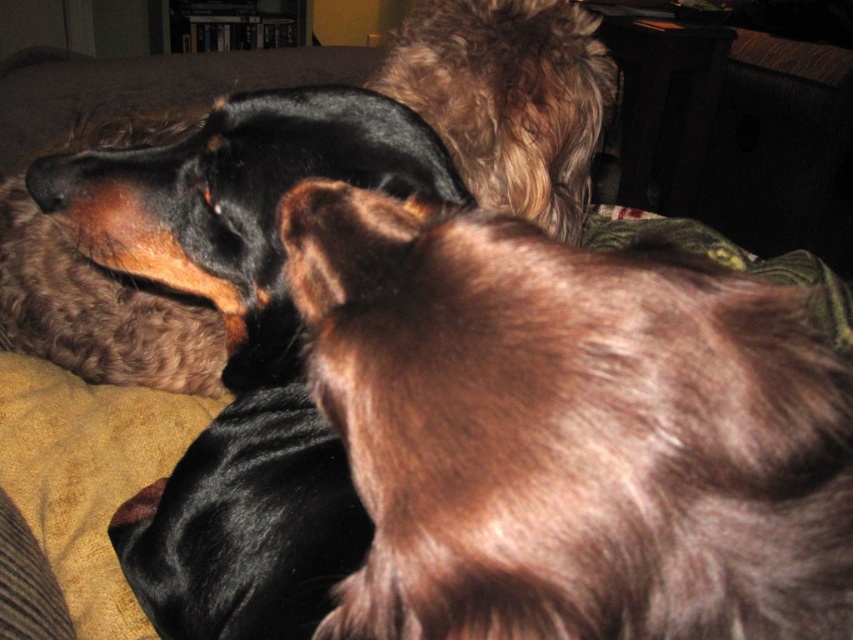
Question: Is shiny black coat at upper left thinner than fuzzy brown dog at upper center?

Choices:
 (A) yes
 (B) no

Answer: (A)

Question: Among these objects, which one is nearest to the camera?

Choices:
 (A) shiny black coat at upper left
 (B) fuzzy brown dog at upper center

Answer: (A)

Question: In this image, where is shiny black coat at upper left located relative to fuzzy brown dog at upper center?

Choices:
 (A) left
 (B) right

Answer: (A)

Question: Is shiny black coat at upper left positioned before fuzzy brown dog at upper center?

Choices:
 (A) yes
 (B) no

Answer: (A)